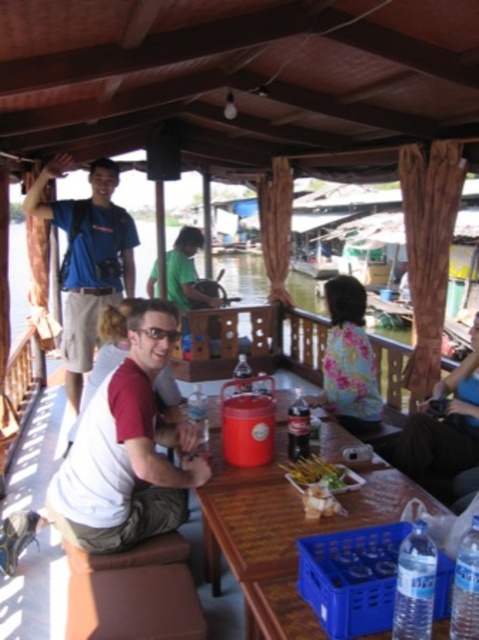
You are a passenger on the boat and want to avoid spilling your food. Which object is closer to the edge of the boat, the white matte shirt at center or the golden crispy skewers at center?

The golden crispy skewers at center are closer to the edge of the boat because the white matte shirt at center is located above them, meaning the skewers are lower and likely nearer the edge where the railing is.

You are a passenger on the boat and want to know if the blue fabric shirt at upper left is positioned higher than the dark brown leather jacket at right. Can you confirm this based on the scene?

The blue fabric shirt at upper left is located above dark brown leather jacket at right, so yes, it is positioned higher.

You are a photographer on the boat and want to take a photo of the blue fabric shirt at upper left and dark brown leather jacket at right. Which of the two items is located more to the left in the image?

The blue fabric shirt at upper left is positioned on the left side of dark brown leather jacket at right, so it is more to the left.